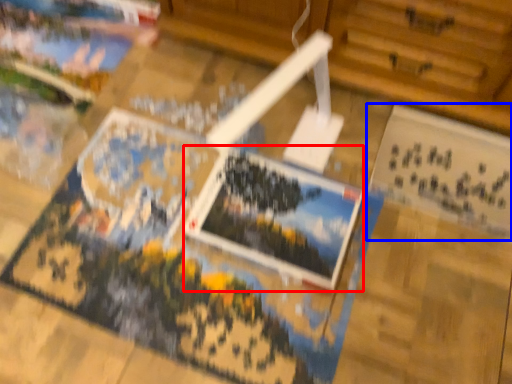
Question: Which object appears closest to the camera in this image, postcard (highlighted by a red box) or postcard (highlighted by a blue box)?

Choices:
 (A) postcard
 (B) postcard

Answer: (A)